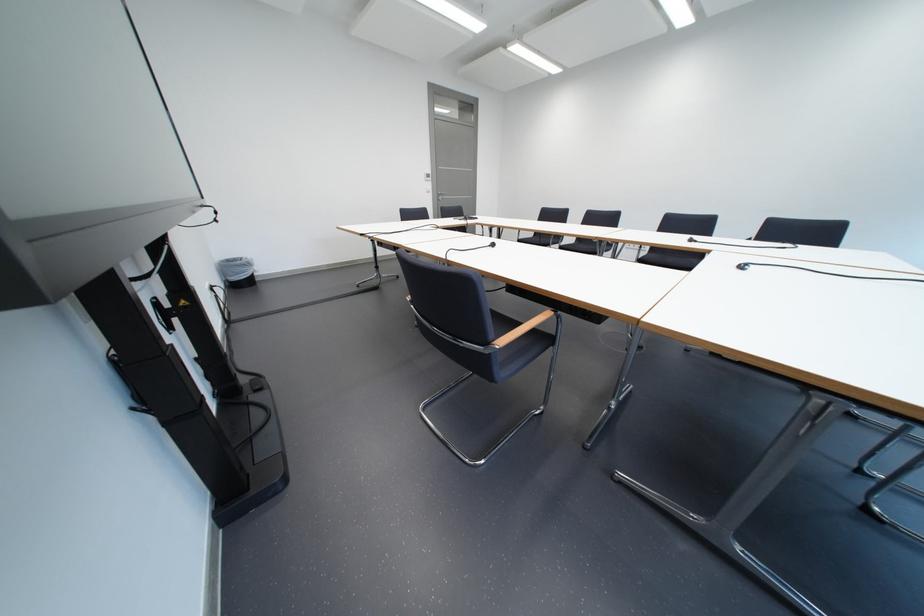
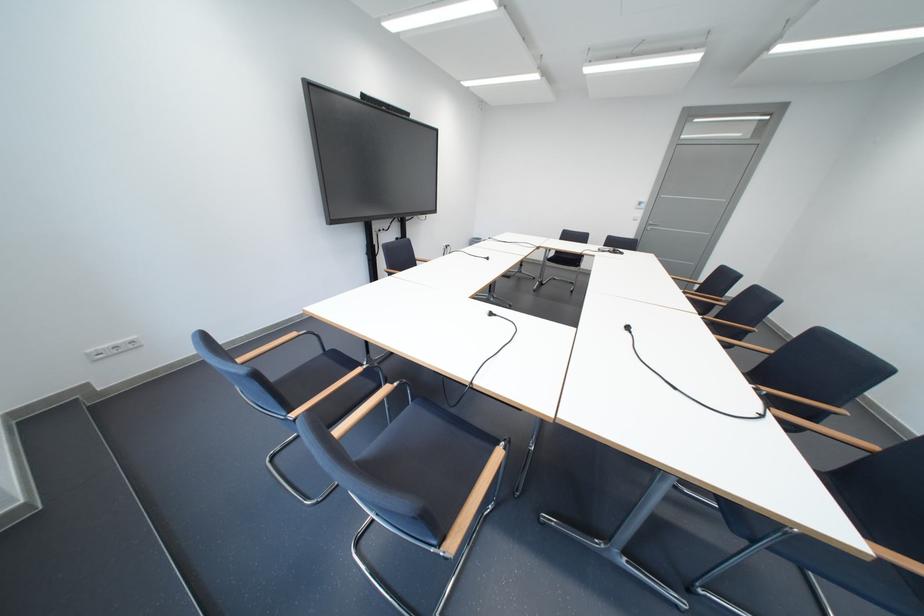
Locate, in the second image, the point that corresponds to point (451, 197) in the first image.

(660, 227)